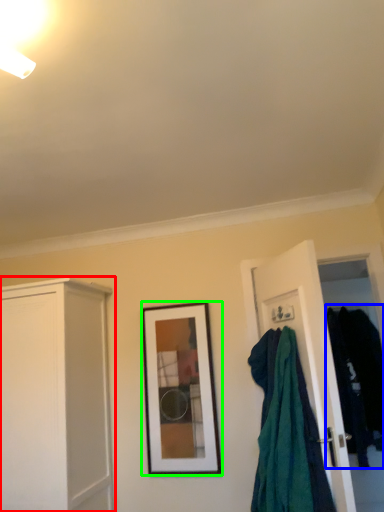
Question: Which is nearer to the cabinetry (highlighted by a red box)? clothing (highlighted by a blue box) or picture frame (highlighted by a green box).

Choices:
 (A) clothing
 (B) picture frame

Answer: (B)